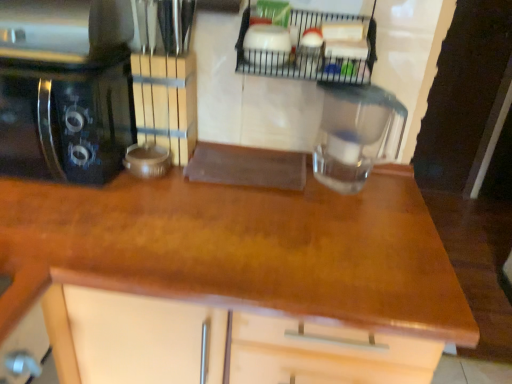
You are a GUI agent. You are given a task and a screenshot of the screen. Output one action in this format:
    pyautogui.click(x=<x>, y=<y>)
    Task: Click on the free location to the right of black glossy coffee maker at left
    
    Given the screenshot: What is the action you would take?
    pyautogui.click(x=155, y=208)